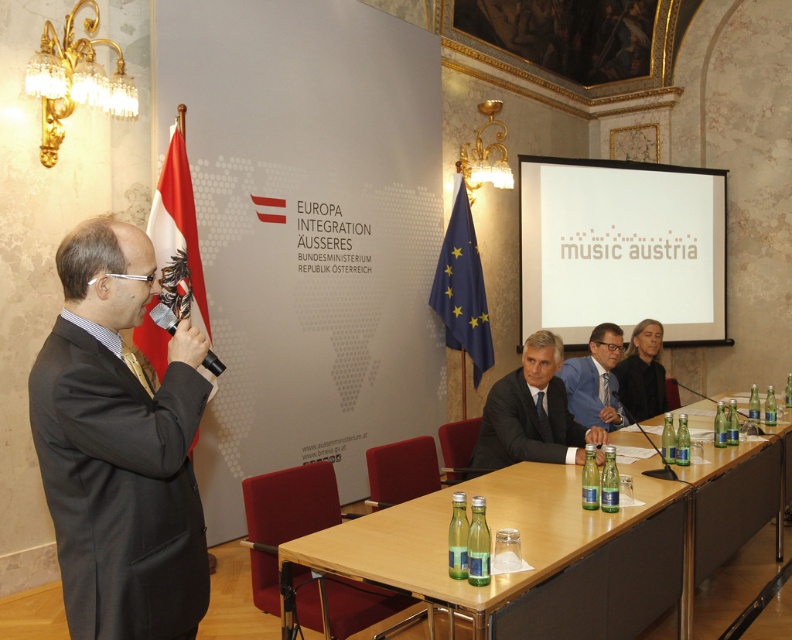
You are standing in the room and want to place a decorative centerpiece on the wooden table at center. If your arm reaches 6 feet, can you comfortably place it without moving closer?

The wooden table at center is 6.19 feet away from viewer. Since your arm reaches 6 feet, you are slightly too far to comfortably place the centerpiece without moving closer.

You are attending the event and need to approach the panel members. Which of the two suits, the dark blue fabric business suit at center or the black suit at center, is positioned closer to the front of the room where the panel members are seated?

The dark blue fabric business suit at center is closer to the viewer, meaning it is positioned closer to the front of the room where the panel members are seated compared to the black suit at center.